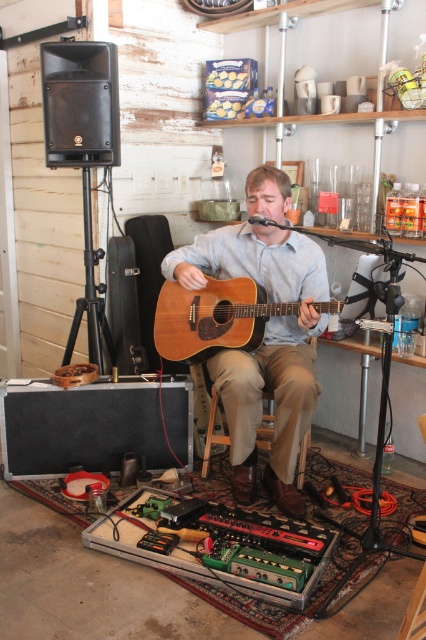
You are a photographer positioned at the origin point of the room. The room has a coordinate system where the bottom left corner is the origin. You need to capture a closeup shot of the wooden acoustic guitar at center. Which direction should you move to get closer to it?

Since the wooden acoustic guitar at center is located at coordinates approximately 0.544 on the x and 0.620 on the y axis, you should move towards the right and upwards from the origin to get closer to it.

In the scene shown: You are a photographer setting up for a shoot in the room. You want to capture the musician playing the guitar while ensuring both the wooden acoustic guitar at center and the natural wood acoustic guitar at center are clearly visible. Which guitar should you focus on first to ensure it fits in the frame?

The wooden acoustic guitar at center is much taller than the natural wood acoustic guitar at center, so you should focus on the wooden acoustic guitar at center first to ensure it fits in the frame.

You are a musician who wants to choose a guitar that is easier to play due to its size. Based on the image, which guitar should you pick between the wooden acoustic guitar at center and the natural wood acoustic guitar at center?

The wooden acoustic guitar at center is thinner than the natural wood acoustic guitar at center, so it would be easier to play due to its smaller size.